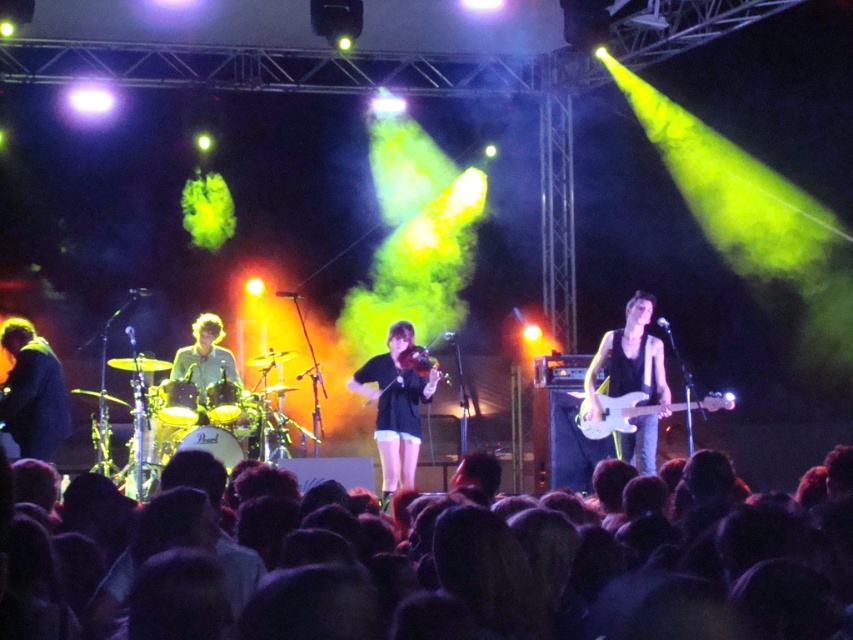
Between dark hair at lower center and black matte shirt at center, which one is positioned lower?

Positioned lower is dark hair at lower center.

Is dark hair at lower center below black matte shirt at center?

Correct, dark hair at lower center is located below black matte shirt at center.

Is point (309, 515) more distant than point (387, 348)?

No, it is not.

Locate an element on the screen. dark hair at lower center is located at coordinates (491, 570).

Which is more to the left, dark blue fabric jacket at left or matte black violin at center?

dark blue fabric jacket at left is more to the left.

Who is more forward, (62, 435) or (424, 371)?

Point (62, 435) is in front.

You are a GUI agent. You are given a task and a screenshot of the screen. Output one action in this format:
    pyautogui.click(x=<x>, y=<y>)
    Task: Click on the dark blue fabric jacket at left
    The image size is (853, 640).
    Given the screenshot: What is the action you would take?
    pyautogui.click(x=32, y=392)

Who is higher up, dark hair at lower center or green matte shirt at center?

Positioned higher is green matte shirt at center.

Which is below, dark hair at lower center or green matte shirt at center?

dark hair at lower center is below.

Between point (693, 560) and point (241, 417), which one is positioned in front?

Point (693, 560) is more forward.

The height and width of the screenshot is (640, 853). Find the location of `dark hair at lower center`. dark hair at lower center is located at coordinates (491, 570).